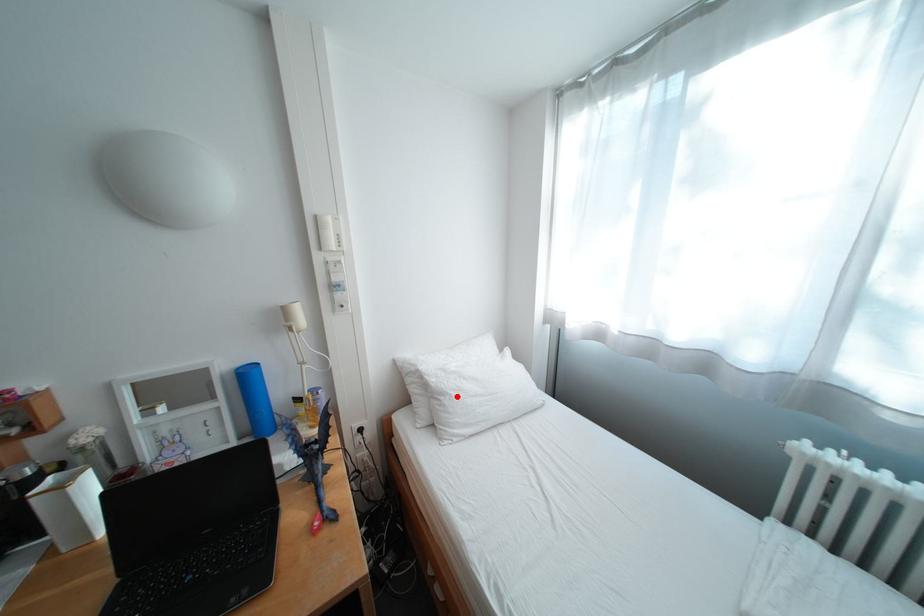
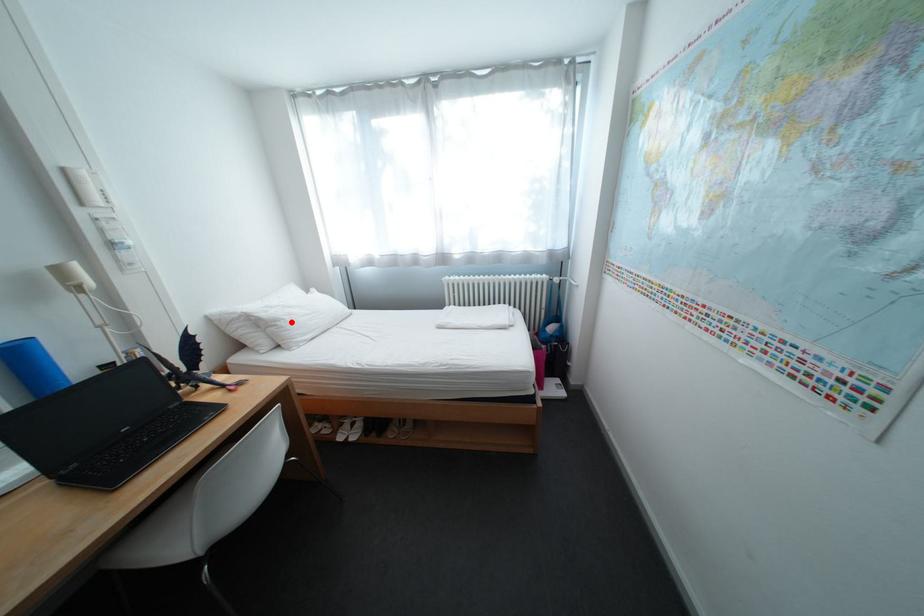
I am providing you with two images of the same scene from different viewpoints. A red point is marked on the first image and another point is marked on the second image. Are the points marked in image1 and image2 representing the same 3D position?

Yes